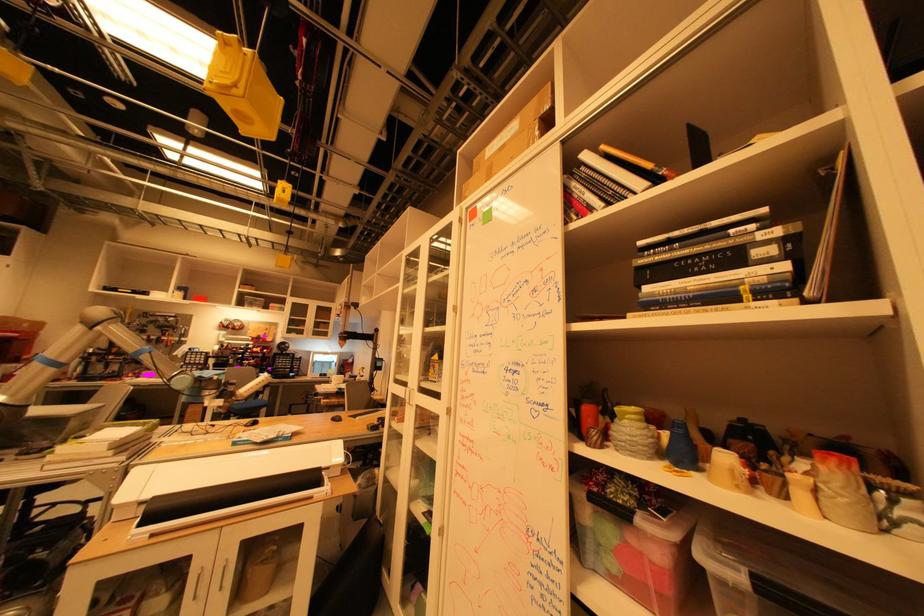
The height and width of the screenshot is (616, 924). In order to click on blue spine book in this screenshot , I will do click(x=716, y=294).